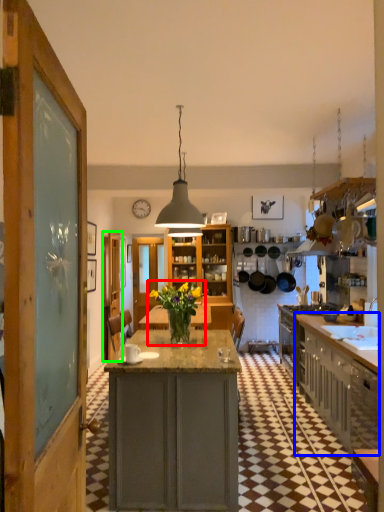
Question: Considering the real-world distances, which object is farthest from floral arrangement (highlighted by a red box)? cabinetry (highlighted by a blue box) or door (highlighted by a green box)?

Choices:
 (A) cabinetry
 (B) door

Answer: (B)